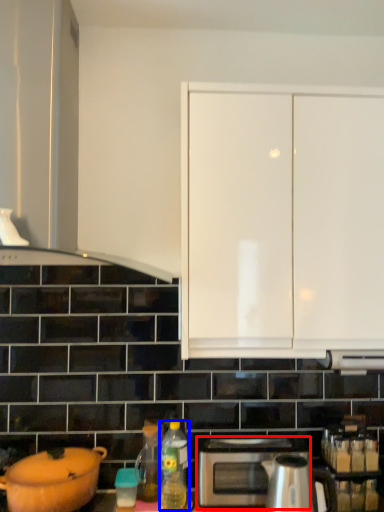
Question: Which of the following is the closest to the observer, microwave (highlighted by a red box) or bottle (highlighted by a blue box)?

Choices:
 (A) microwave
 (B) bottle

Answer: (B)